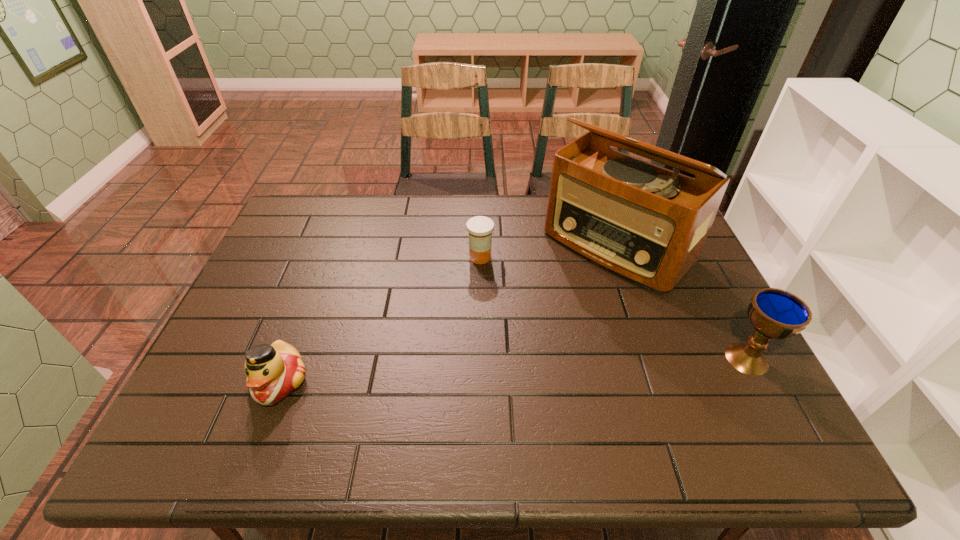
Image resolution: width=960 pixels, height=540 pixels. In order to click on vacant space located 0.150m on the front panel of the radio receiver in this screenshot , I will do `click(546, 310)`.

Image resolution: width=960 pixels, height=540 pixels. Identify the location of object that is at the far edge. (648, 224).

You are a GUI agent. You are given a task and a screenshot of the screen. Output one action in this format:
    pyautogui.click(x=<x>, y=<y>)
    Task: Click on the duck situated at the near edge
    
    Given the screenshot: What is the action you would take?
    pyautogui.click(x=273, y=372)

I want to click on chalice positioned at the near edge, so click(x=774, y=313).

Locate an element on the screen. The image size is (960, 540). object that is at the left edge is located at coordinates (273, 372).

You are a GUI agent. You are given a task and a screenshot of the screen. Output one action in this format:
    pyautogui.click(x=<x>, y=<y>)
    Task: Click on the chalice that is at the right edge
    This screenshot has width=960, height=540.
    Given the screenshot: What is the action you would take?
    pyautogui.click(x=774, y=313)

Locate an element on the screen. The height and width of the screenshot is (540, 960). radio receiver present at the right edge is located at coordinates (648, 224).

Locate an element on the screen. The width and height of the screenshot is (960, 540). object present at the near left corner is located at coordinates [x=273, y=372].

Find the location of a particular element. The width and height of the screenshot is (960, 540). object that is at the far right corner is located at coordinates (648, 224).

This screenshot has width=960, height=540. I want to click on object that is at the near right corner, so click(774, 313).